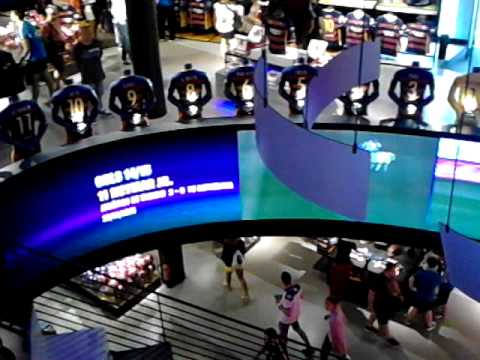
The width and height of the screenshot is (480, 360). Identify the location of right screen. (475, 175).